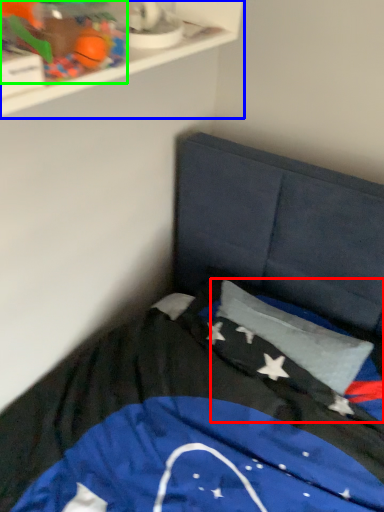
Question: Which object is the farthest from flag (highlighted by a red box)? Choose among these: shelf (highlighted by a blue box) or toy (highlighted by a green box).

Choices:
 (A) shelf
 (B) toy

Answer: (B)